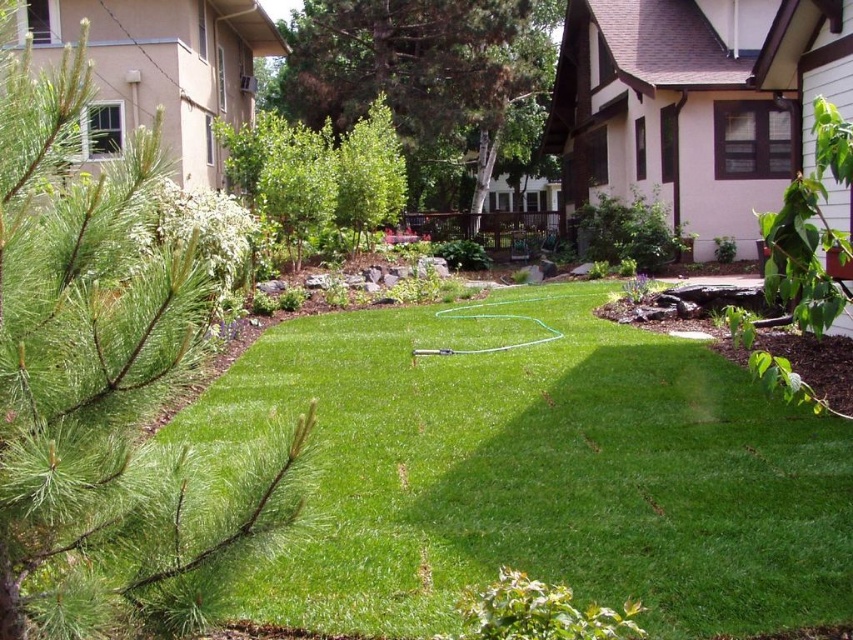
Question: Is green needle-like at left positioned in front of green leafy tree at center?

Choices:
 (A) yes
 (B) no

Answer: (A)

Question: Considering the relative positions of green grass at center and green needle-like at left in the image provided, where is green grass at center located with respect to green needle-like at left?

Choices:
 (A) below
 (B) above

Answer: (B)

Question: Considering the real-world distances, which object is closest to the green grass at center?

Choices:
 (A) green needle-like at left
 (B) green leafy tree at center

Answer: (A)

Question: Which of the following is the closest to the observer?

Choices:
 (A) (109, 298)
 (B) (410, 136)

Answer: (A)

Question: Estimate the real-world distances between objects in this image. Which object is farther from the green leafy tree at upper center?

Choices:
 (A) green needle-like at left
 (B) green leafy tree at center
 (C) green grass at center

Answer: (A)

Question: Is green grass at center above green leafy tree at center?

Choices:
 (A) no
 (B) yes

Answer: (A)